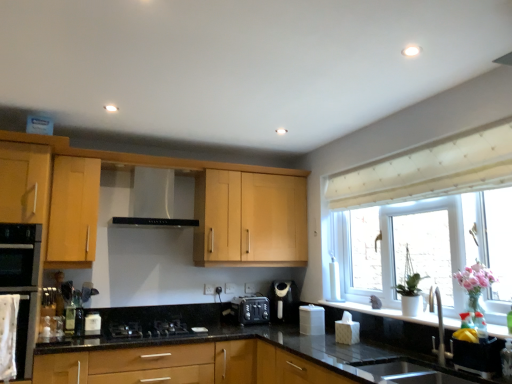
Question: Should I look upward or downward to see white plastic tissue box at lower right?

Choices:
 (A) down
 (B) up

Answer: (A)

Question: Is black granite sink at lower center, the second sink from the top, directly adjacent to translucent glass bottle at lower left?

Choices:
 (A) no
 (B) yes

Answer: (A)

Question: From the image's perspective, does black granite sink at lower center, positioned as the 1th sink in bottom-to-top order, appear higher than translucent glass bottle at lower left?

Choices:
 (A) no
 (B) yes

Answer: (A)

Question: Is black granite sink at lower center, the second sink from the top, shorter than translucent glass bottle at lower left?

Choices:
 (A) no
 (B) yes

Answer: (A)

Question: Does black granite sink at lower center, the second sink from the top, appear on the right side of translucent glass bottle at lower left?

Choices:
 (A) no
 (B) yes

Answer: (B)

Question: Does black granite sink at lower center, positioned as the 1th sink in bottom-to-top order, have a lesser width compared to translucent glass bottle at lower left?

Choices:
 (A) yes
 (B) no

Answer: (B)

Question: Is the position of black granite sink at lower center, the second sink from the top, less distant than that of translucent glass bottle at lower left?

Choices:
 (A) no
 (B) yes

Answer: (B)

Question: Considering the relative sizes of black matte oven at left and black plastic toaster at center in the image provided, is black matte oven at left wider than black plastic toaster at center?

Choices:
 (A) no
 (B) yes

Answer: (B)

Question: From the image's perspective, would you say black matte oven at left is shown under black plastic toaster at center?

Choices:
 (A) no
 (B) yes

Answer: (A)

Question: Is black plastic toaster at center at the back of black matte oven at left?

Choices:
 (A) yes
 (B) no

Answer: (B)

Question: Is black matte oven at left further to camera compared to black plastic toaster at center?

Choices:
 (A) yes
 (B) no

Answer: (B)

Question: Is black matte oven at left taller than black plastic toaster at center?

Choices:
 (A) yes
 (B) no

Answer: (A)

Question: Considering the relative sizes of black matte oven at left and black plastic toaster at center in the image provided, is black matte oven at left shorter than black plastic toaster at center?

Choices:
 (A) no
 (B) yes

Answer: (A)

Question: Does translucent glass bottle at lower left have a lesser height compared to black plastic toaster at center?

Choices:
 (A) no
 (B) yes

Answer: (A)